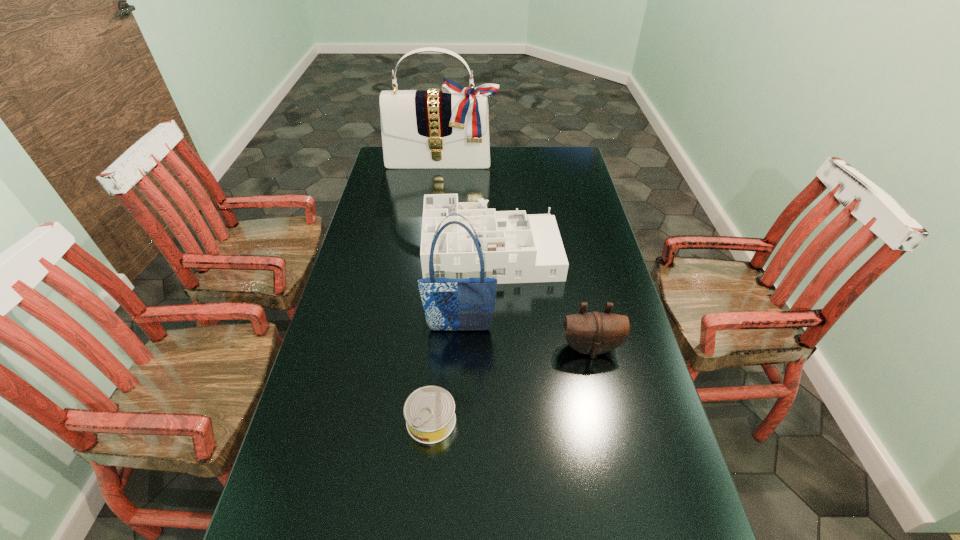
This screenshot has width=960, height=540. Identify the location of satchel. (449, 128).

At what (x,y) coordinates should I click in order to perform the action: click on the farthest object. Please return your answer as a coordinate pair (x, y). The width and height of the screenshot is (960, 540). Looking at the image, I should click on (449, 128).

I want to click on shopping bag, so click(450, 304).

I want to click on pouch, so click(594, 333).

Image resolution: width=960 pixels, height=540 pixels. What are the coordinates of `dollhouse` in the screenshot? It's located at (517, 248).

The image size is (960, 540). I want to click on can, so click(429, 411).

Find the location of a particular element. The width and height of the screenshot is (960, 540). the shortest object is located at coordinates (429, 411).

This screenshot has width=960, height=540. What are the coordinates of `free space located 0.240m on the front-facing side of the tallest object` in the screenshot? It's located at (437, 204).

The image size is (960, 540). Identify the location of vacant space located on the front-facing side of the second tallest object. (458, 368).

The width and height of the screenshot is (960, 540). In order to click on vacant area situated with the flap open on the pouch in this screenshot , I will do `click(605, 415)`.